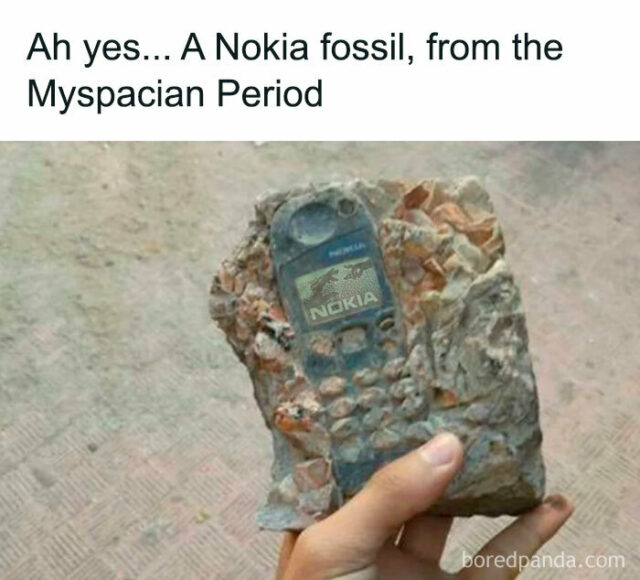
Find the location of a particular element. The width and height of the screenshot is (640, 580). phone is located at coordinates 371,317.